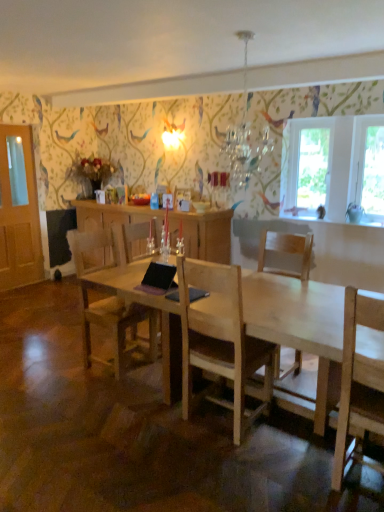
Measure the distance between point [305,280] and camera.

They are 10.25 feet apart.

The width and height of the screenshot is (384, 512). What do you see at coordinates (157, 278) in the screenshot?
I see `black matte laptop at center` at bounding box center [157, 278].

Describe the element at coordinates (368, 167) in the screenshot. I see `transparent glass window at right, the first window screen from the right` at that location.

Find the location of a particular element. This screenshot has height=512, width=384. natural wood table at center is located at coordinates (300, 326).

Is wooden cabinet at center positioned far away from transparent glass window at right, the first window screen from the right?

wooden cabinet at center is far away from transparent glass window at right, the first window screen from the right.

Is wooden cabinet at center behind transparent glass window at right, the first window screen from the right?

Yes.

Measure the distance from wooden cabinet at center to transparent glass window at right, the first window screen from the right.

wooden cabinet at center is 4.99 feet away from transparent glass window at right, the first window screen from the right.

From a real-world perspective, which is physically below, wooden cabinet at center or transparent glass window at right, the second window screen positioned from the left?

In real-world perspective, wooden cabinet at center is lower.

From the image's perspective, is natural wood table at center below light brown wooden chair at center, the first chair viewed from the left?

Indeed, from the image's perspective, natural wood table at center is shown beneath light brown wooden chair at center, the first chair viewed from the left.

Considering the relative positions of natural wood table at center and light brown wooden chair at center, the first chair viewed from the left, in the image provided, is natural wood table at center to the right of light brown wooden chair at center, the first chair viewed from the left, from the viewer's perspective?

Indeed, natural wood table at center is positioned on the right side of light brown wooden chair at center, the first chair viewed from the left.

From a real-world perspective, is natural wood table at center located higher than light brown wooden chair at center, the first chair viewed from the left?

No, from a real-world perspective, natural wood table at center is not over light brown wooden chair at center, the first chair viewed from the left

Which object is wider, natural wood table at center or light brown wooden chair at center, arranged as the second chair when viewed from the right?

Wider between the two is natural wood table at center.

From a real-world perspective, is crystal glass chandelier at upper center physically located above or below black matte laptop at center?

Clearly, from a real-world perspective, crystal glass chandelier at upper center is above black matte laptop at center.

Is crystal glass chandelier at upper center wider than black matte laptop at center?

Indeed, crystal glass chandelier at upper center has a greater width compared to black matte laptop at center.

You are a GUI agent. You are given a task and a screenshot of the screen. Output one action in this format:
    pyautogui.click(x=<x>, y=<y>)
    Task: Click on the lamp to the right of black matte laptop at center
    The image size is (384, 512).
    Given the screenshot: What is the action you would take?
    pyautogui.click(x=244, y=136)

From the image's perspective, is transparent glass window at upper right, the second window screen positioned from the right, above light wood chair at center, arranged as the 1th chair when viewed from the right?

Indeed, from the image's perspective, transparent glass window at upper right, the second window screen positioned from the right, is shown above light wood chair at center, arranged as the 1th chair when viewed from the right.

Which object is further away from the camera taking this photo, transparent glass window at upper right, the second window screen positioned from the right, or light wood chair at center, arranged as the 1th chair when viewed from the right?

transparent glass window at upper right, the second window screen positioned from the right, is more distant.

In the scene shown: Does transparent glass window at upper right, marked as the first window screen in a left-to-right arrangement, have a lesser height compared to light wood chair at center, arranged as the 1th chair when viewed from the right?

Yes, transparent glass window at upper right, marked as the first window screen in a left-to-right arrangement, is shorter than light wood chair at center, arranged as the 1th chair when viewed from the right.

Can you tell me how much transparent glass window at right, the second window screen positioned from the left, and natural wood table at center differ in facing direction?

transparent glass window at right, the second window screen positioned from the left, and natural wood table at center are facing 0.0309 degrees away from each other.

Between point (372, 205) and point (316, 334), which one is positioned in front?

The point (316, 334) is closer.

Who is smaller, transparent glass window at right, the second window screen positioned from the left, or natural wood table at center?

transparent glass window at right, the second window screen positioned from the left, is smaller.

Can you confirm if transparent glass window at right, the first window screen from the right, is shorter than natural wood table at center?

No.

Does crystal glass chandelier at upper center have a smaller size compared to transparent glass window at right, the second window screen positioned from the left?

Actually, crystal glass chandelier at upper center might be larger than transparent glass window at right, the second window screen positioned from the left.

Can you tell me how much crystal glass chandelier at upper center and transparent glass window at right, the second window screen positioned from the left, differ in facing direction?

3.64 degrees.

Does crystal glass chandelier at upper center contain transparent glass window at right, the first window screen from the right?

Actually, transparent glass window at right, the first window screen from the right, is outside crystal glass chandelier at upper center.

Between crystal glass chandelier at upper center and transparent glass window at right, the first window screen from the right, which one has smaller width?

transparent glass window at right, the first window screen from the right, is thinner.

From a real-world perspective, is light brown wooden chair at center, the first chair viewed from the left, above or below black matte laptop at center?

light brown wooden chair at center, the first chair viewed from the left, is below black matte laptop at center.

Between light brown wooden chair at center, the first chair viewed from the left, and black matte laptop at center, which one is positioned behind?

light brown wooden chair at center, the first chair viewed from the left, is further from the camera.

What are the coordinates of `cabinetry below the transparent glass window at right, the second window screen positioned from the left (from the image's perspective)` in the screenshot? It's located at (206, 234).

You are a GUI agent. You are given a task and a screenshot of the screen. Output one action in this format:
    pyautogui.click(x=<x>, y=<y>)
    Task: Click on the 2nd chair above the natural wood table at center (from the image's perspective)
    The width and height of the screenshot is (384, 512).
    Given the screenshot: What is the action you would take?
    pyautogui.click(x=109, y=296)

When comparing their distances from light wood chair at center, arranged as the 1th chair when viewed from the right, does wooden cabinet at center or crystal glass chandelier at upper center seem closer?

wooden cabinet at center.

Considering their positions, is wooden cabinet at center positioned further to transparent glass window at right, the second window screen positioned from the left, than transparent glass window at upper right, marked as the first window screen in a left-to-right arrangement?

wooden cabinet at center is positioned further to the anchor transparent glass window at right, the second window screen positioned from the left.

From the image, which object appears to be farther from light wood chair at center, which ranks as the 2th chair in left-to-right order, transparent glass window at upper right, the second window screen positioned from the right, or crystal glass chandelier at upper center?

Based on the image, crystal glass chandelier at upper center appears to be further to light wood chair at center, which ranks as the 2th chair in left-to-right order.

Based on their spatial positions, is natural wood table at center or light brown wooden chair at center, arranged as the second chair when viewed from the right, closer to transparent glass window at right, the second window screen positioned from the left?

natural wood table at center is positioned closer to the anchor transparent glass window at right, the second window screen positioned from the left.

Considering their positions, is light wood chair at center, which ranks as the 2th chair in left-to-right order, positioned further to black matte laptop at center than transparent glass window at upper right, the second window screen positioned from the right?

Based on the image, transparent glass window at upper right, the second window screen positioned from the right, appears to be further to black matte laptop at center.

Based on their spatial positions, is transparent glass window at right, the second window screen positioned from the left, or natural wood table at center further from crystal glass chandelier at upper center?

Among the two, natural wood table at center is located further to crystal glass chandelier at upper center.

When comparing their distances from crystal glass chandelier at upper center, does wooden cabinet at center or black matte laptop at center seem closer?

wooden cabinet at center.

When comparing their distances from wooden cabinet at center, does transparent glass window at right, the first window screen from the right, or transparent glass window at upper right, the second window screen positioned from the right, seem closer?

The object closer to wooden cabinet at center is transparent glass window at upper right, the second window screen positioned from the right.

In order to click on chair between light wood chair at center, which ranks as the 2th chair in left-to-right order, and wooden cabinet at center, along the z-axis in this screenshot , I will do [x=109, y=296].

Image resolution: width=384 pixels, height=512 pixels. In order to click on chair between light brown wooden chair at center, arranged as the second chair when viewed from the right, and transparent glass window at right, the first window screen from the right, from left to right in this screenshot , I will do `click(285, 254)`.

In order to click on laptop positioned between light wood chair at center, arranged as the 1th chair when viewed from the right, and wooden cabinet at center from near to far in this screenshot , I will do `click(157, 278)`.

Identify the location of laptop positioned between natural wood table at center and wooden cabinet at center from near to far. (157, 278).